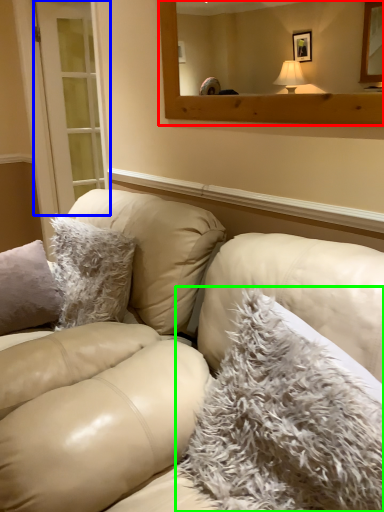
Question: Considering the real-world distances, which object is closest to mirror (highlighted by a red box)? glass door (highlighted by a blue box) or pillow (highlighted by a green box).

Choices:
 (A) glass door
 (B) pillow

Answer: (B)